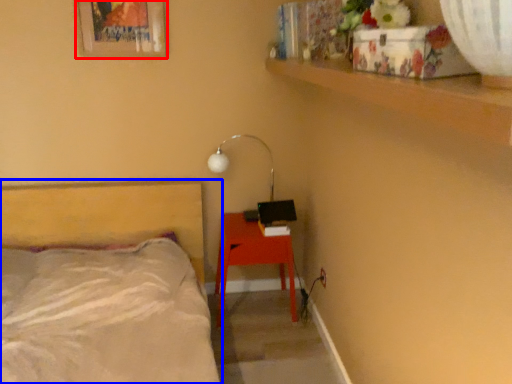
Question: Among these objects, which one is nearest to the camera, picture frame (highlighted by a red box) or bed (highlighted by a blue box)?

Choices:
 (A) picture frame
 (B) bed

Answer: (B)